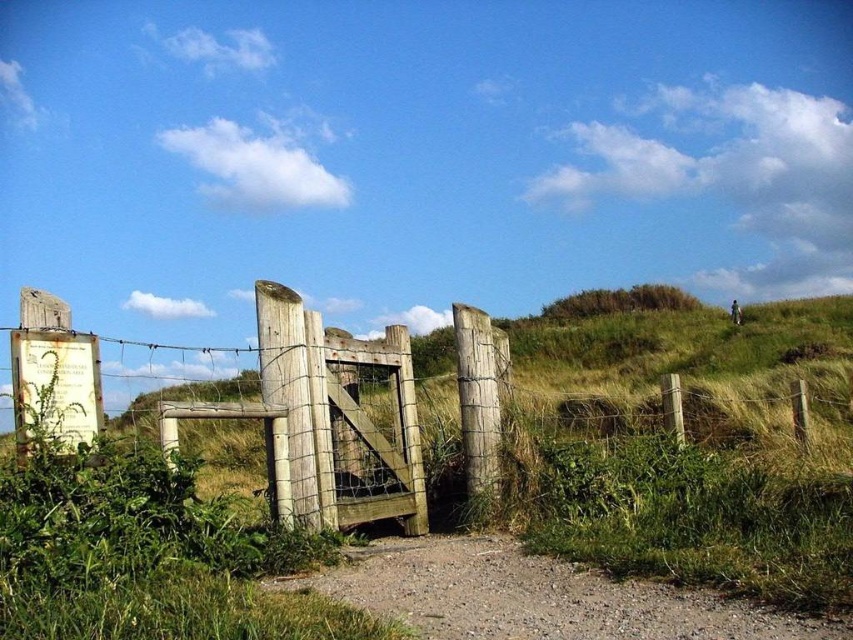
Question: Does weathered wood gate at center appear on the right side of dirt/gravel path at center?

Choices:
 (A) yes
 (B) no

Answer: (B)

Question: Is the position of weathered wood gate at center more distant than that of dirt/gravel path at center?

Choices:
 (A) no
 (B) yes

Answer: (B)

Question: Does weathered wood gate at center have a smaller size compared to dirt/gravel path at center?

Choices:
 (A) no
 (B) yes

Answer: (A)

Question: Among these points, which one is nearest to the camera?

Choices:
 (A) (538, 612)
 (B) (273, 378)

Answer: (A)

Question: Which of the following is the farthest from the observer?

Choices:
 (A) (254, 296)
 (B) (404, 612)

Answer: (A)